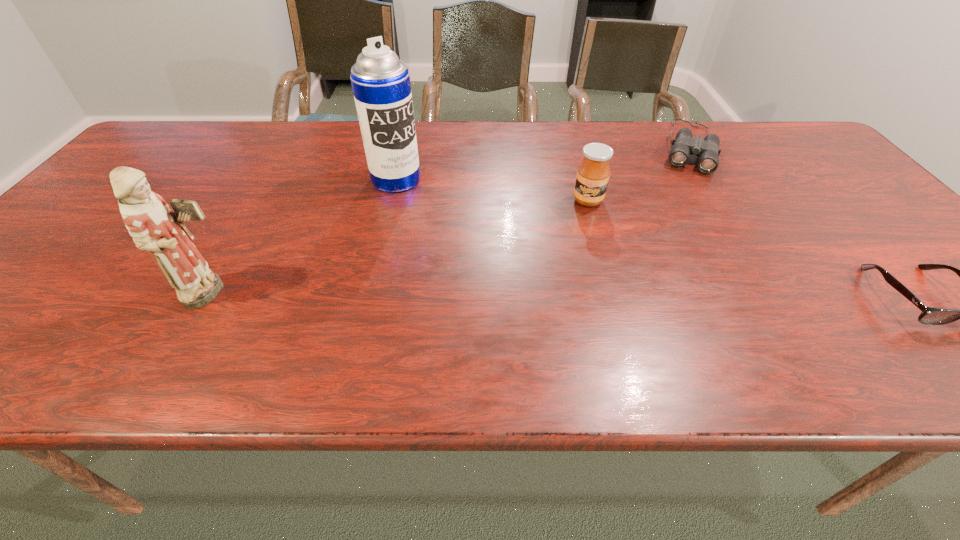
Image resolution: width=960 pixels, height=540 pixels. In the image, there is a desktop. Find the location of `free space at the near edge`. free space at the near edge is located at coordinates (794, 298).

This screenshot has height=540, width=960. What are the coordinates of `free space at the right edge of the desktop` in the screenshot? It's located at (826, 162).

In the image, there is a desktop. Find the location of `free space at the near left corner`. free space at the near left corner is located at coordinates (60, 307).

Identify the location of unoccupied area between the fourth shortest object and the fourth object from left to right. (450, 220).

You are a GUI agent. You are given a task and a screenshot of the screen. Output one action in this format:
    pyautogui.click(x=<x>, y=<y>)
    Task: Click on the vacant space that's between the aerosol can and the fourth object from left to right
    
    Given the screenshot: What is the action you would take?
    pyautogui.click(x=542, y=163)

Locate an element on the screen. The image size is (960, 540). free space that is in between the third shortest object and the figurine is located at coordinates (400, 247).

The width and height of the screenshot is (960, 540). Identify the location of vacant point located between the fourth object from left to right and the figurine. (450, 220).

At what (x,y) coordinates should I click in order to perform the action: click on vacant space that is in between the binoculars and the figurine. Please return your answer as a coordinate pair (x, y). The width and height of the screenshot is (960, 540). Looking at the image, I should click on (450, 220).

Find the location of `free space between the second tallest object and the binoculars`. free space between the second tallest object and the binoculars is located at coordinates (450, 220).

Identify the location of object that is the closest to the rightmost object. This screenshot has height=540, width=960. (707, 150).